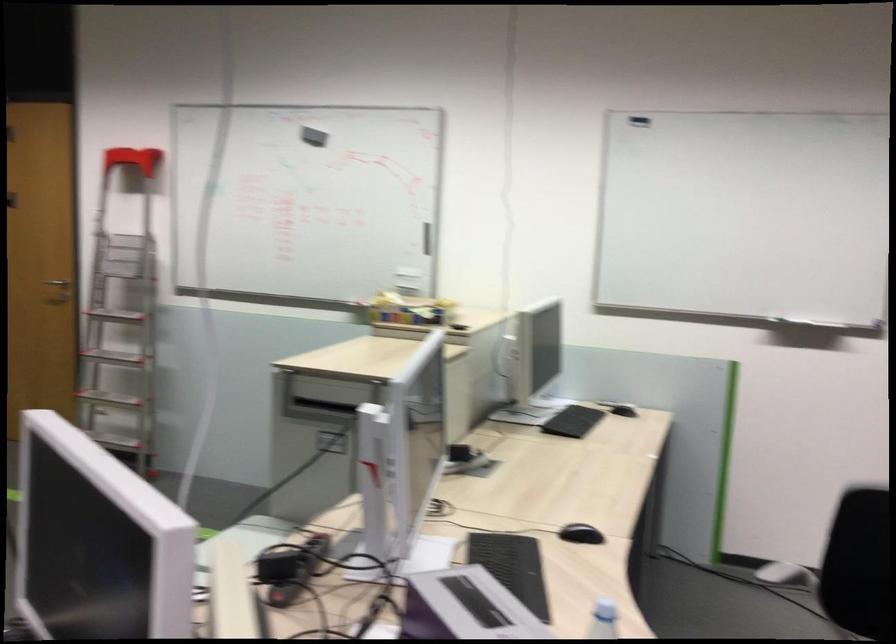
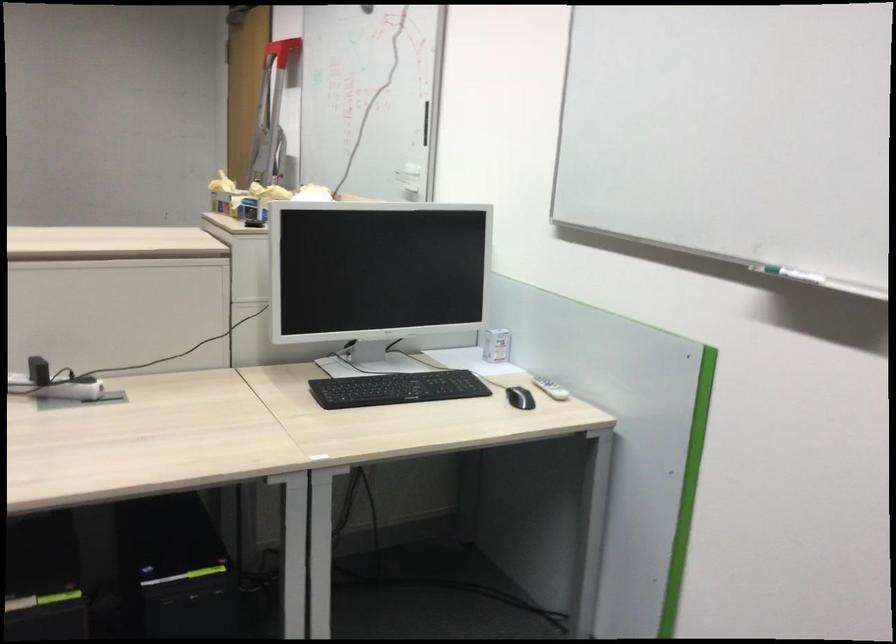
In the second image, find the point that corresponds to pixel 797 313 in the first image.

(794, 275)